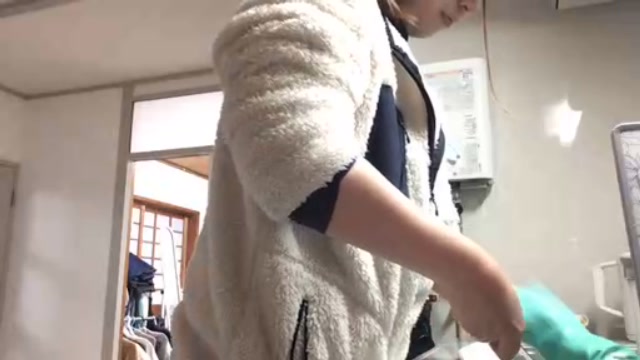
Locate an element on the screen. The width and height of the screenshot is (640, 360). door trim is located at coordinates (128, 92), (125, 141), (121, 226), (112, 320).